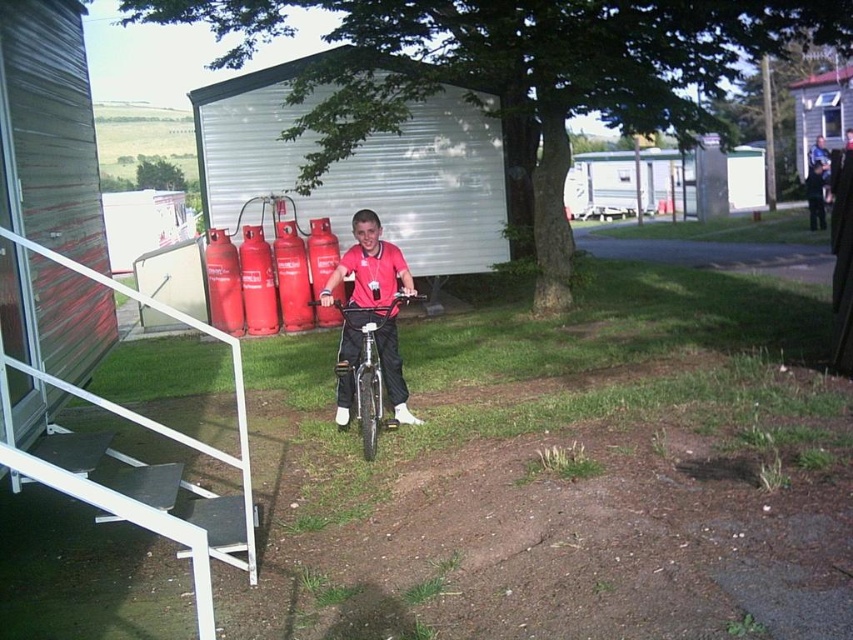
Is point (357, 385) less distant than point (828, 161)?

Yes, point (357, 385) is in front of point (828, 161).

Does shiny metallic bicycle at center appear on the right side of blue denim shirt at upper right?

Incorrect, shiny metallic bicycle at center is not on the right side of blue denim shirt at upper right.

Which is behind, point (381, 387) or point (828, 182)?

The point (828, 182) is more distant.

You are a GUI agent. You are given a task and a screenshot of the screen. Output one action in this format:
    pyautogui.click(x=<x>, y=<y>)
    Task: Click on the shiny metallic bicycle at center
    
    Given the screenshot: What is the action you would take?
    pyautogui.click(x=370, y=369)

Can you confirm if blue denim shirt at upper right is shorter than white plastic pole at upper center?

In fact, blue denim shirt at upper right may be taller than white plastic pole at upper center.

Is blue denim shirt at upper right further to camera compared to white plastic pole at upper center?

No, it is in front of white plastic pole at upper center.

This screenshot has height=640, width=853. I want to click on blue denim shirt at upper right, so click(x=821, y=163).

Is brushed metal pole at upper right behind white plastic pole at upper center?

No.

Who is more distant from viewer, (762, 81) or (637, 140)?

The point (637, 140) is behind.

Identify the location of brushed metal pole at upper right. The width and height of the screenshot is (853, 640). (769, 132).